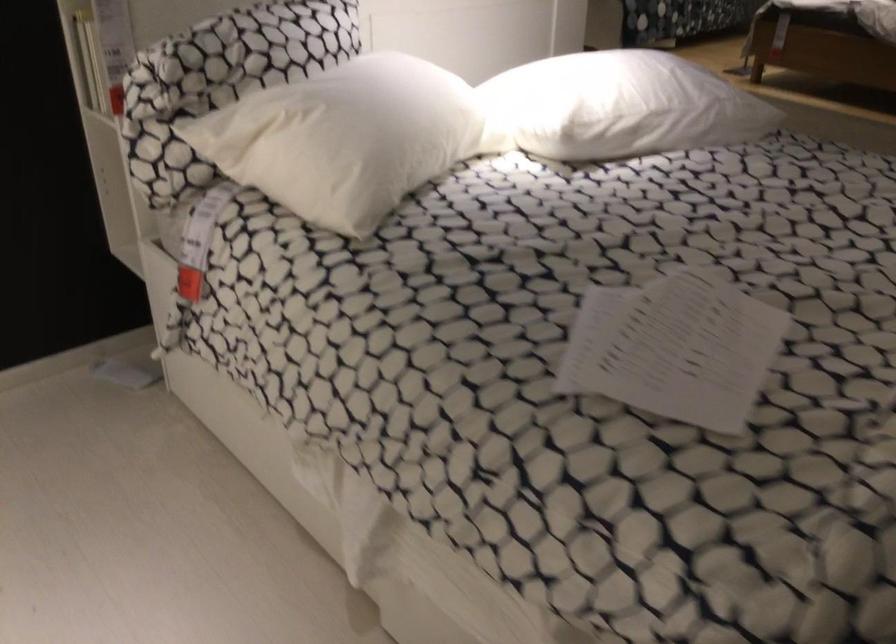
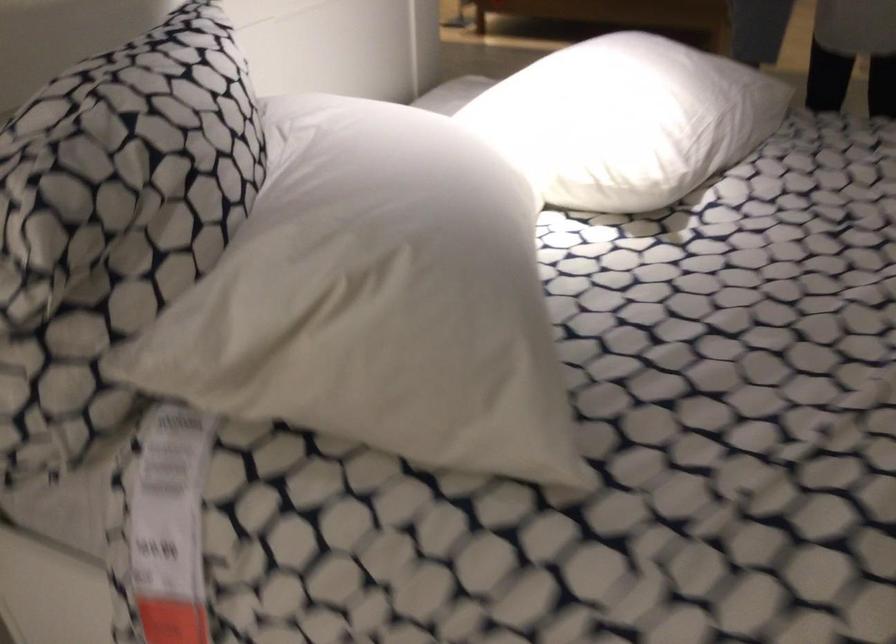
Where in the second image is the point corresponding to (x=207, y=236) from the first image?

(169, 526)